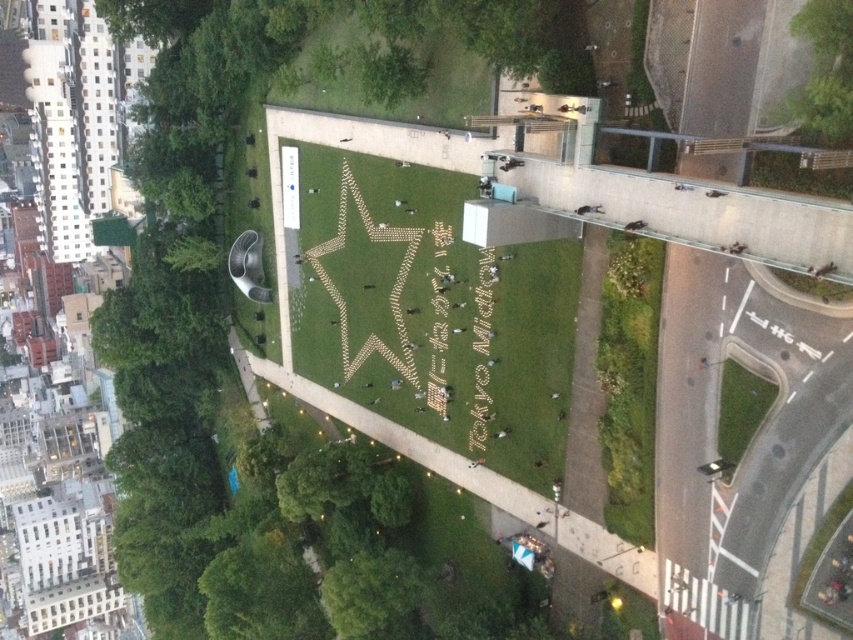
Does green leafy tree at lower left have a greater height compared to green leafy tree at lower center?

Correct, green leafy tree at lower left is much taller as green leafy tree at lower center.

Can you confirm if green leafy tree at lower left is bigger than green leafy tree at lower center?

Yes, green leafy tree at lower left is bigger than green leafy tree at lower center.

Measure the distance between point (207, 632) and camera.

Point (207, 632) and camera are 102.52 meters apart.

Where is `green leafy tree at lower left`? The image size is (853, 640). green leafy tree at lower left is located at coordinates (260, 593).

Between green leafy tree at lower center and green grass at lower right, which one appears on the left side from the viewer's perspective?

Positioned to the left is green leafy tree at lower center.

Which of these two, green leafy tree at lower center or green grass at lower right, stands shorter?

green grass at lower right is shorter.

Which is behind, point (416, 637) or point (764, 381)?

The point (416, 637) is more distant.

Identify the location of green leafy tree at lower center. The image size is (853, 640). (373, 596).

Is green leafy tree at lower left bigger than green grass at lower right?

Correct, green leafy tree at lower left is larger in size than green grass at lower right.

Measure the distance between green leafy tree at lower left and camera.

green leafy tree at lower left is 287.49 feet away from camera.

Locate an element on the screen. green leafy tree at lower left is located at coordinates (260, 593).